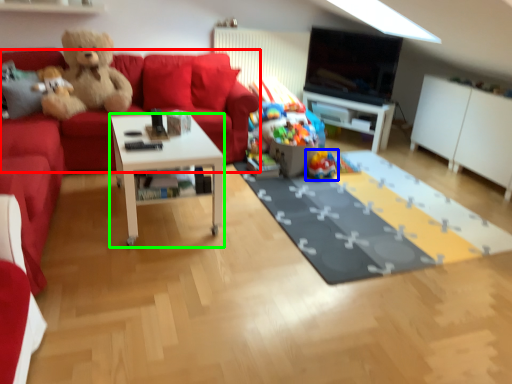
Question: Which object is the closest to the couch (highlighted by a red box)? Choose among these: toy (highlighted by a blue box) or coffee table (highlighted by a green box).

Choices:
 (A) toy
 (B) coffee table

Answer: (A)